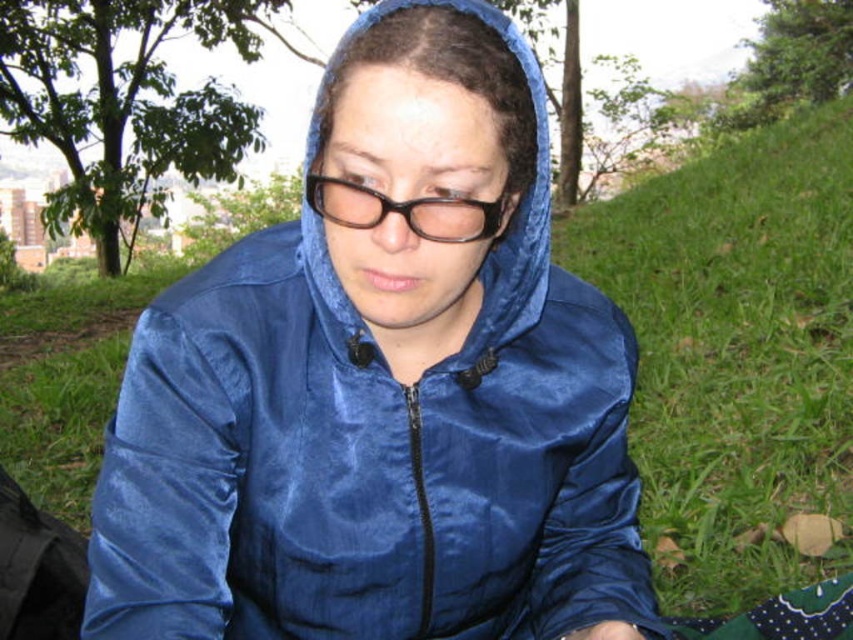
You are a photographer trying to capture the perfect shot of the person in the blue hooded jacket. You notice two points in the scene at coordinates point (254,257) and point (444,212). Which point is closer to your camera lens?

Point (254,257) is further to the viewer than point (444,212), so the point closer to the camera lens is point (444,212).

You are a photographer trying to capture a closeup of the satin blue jacket at center. The camera you are using has a minimum focusing distance of 25 inches. Will you be able to adjust your position to take the photo without moving the jacket?

The satin blue jacket at center is 24.96 inches from camera. Since the minimum focusing distance is 25 inches, you need to move further away to at least 25 inches to focus properly. Therefore, you cannot take the closeup without moving the jacket closer or adjusting your position to meet the required distance.

You are a photographer trying to capture the black plastic glasses at center while ensuring the green grass at lower right is visible in the background. Given their relative sizes, will the glasses be clearly visible in the photo?

The green grass at lower right is taller than the black plastic glasses at center, so the glasses may be partially obscured by the grass, making them less visible in the photo.